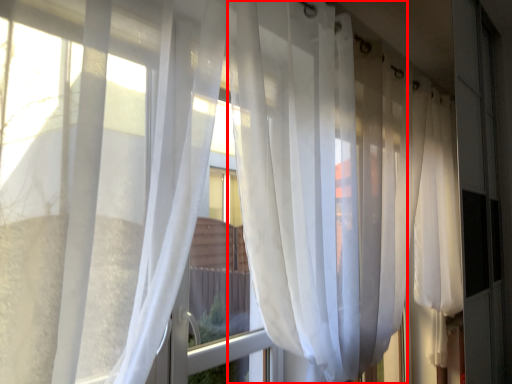
Question: From the image's perspective, where is curtain (annotated by the red box) located in relation to curtain in the image?

Choices:
 (A) below
 (B) above

Answer: (A)